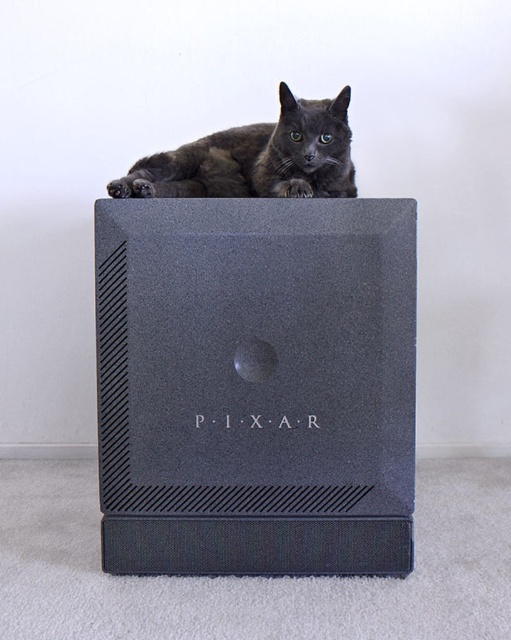
Question: Observing the image, what is the correct spatial positioning of matte black speaker at center in reference to shiny black cat at upper center?

Choices:
 (A) left
 (B) right

Answer: (B)

Question: Is the position of matte black speaker at center more distant than that of shiny black cat at upper center?

Choices:
 (A) no
 (B) yes

Answer: (A)

Question: Which point is farther to the camera?

Choices:
 (A) matte black speaker at center
 (B) shiny black cat at upper center

Answer: (B)

Question: Which object is closer to the camera taking this photo?

Choices:
 (A) shiny black cat at upper center
 (B) matte black speaker at center

Answer: (B)

Question: Can you confirm if matte black speaker at center is smaller than shiny black cat at upper center?

Choices:
 (A) yes
 (B) no

Answer: (A)